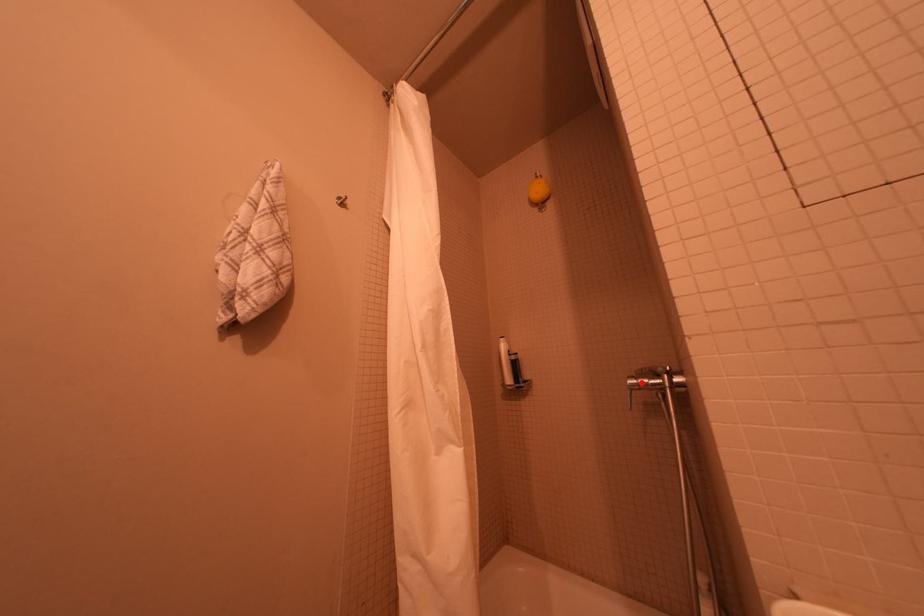
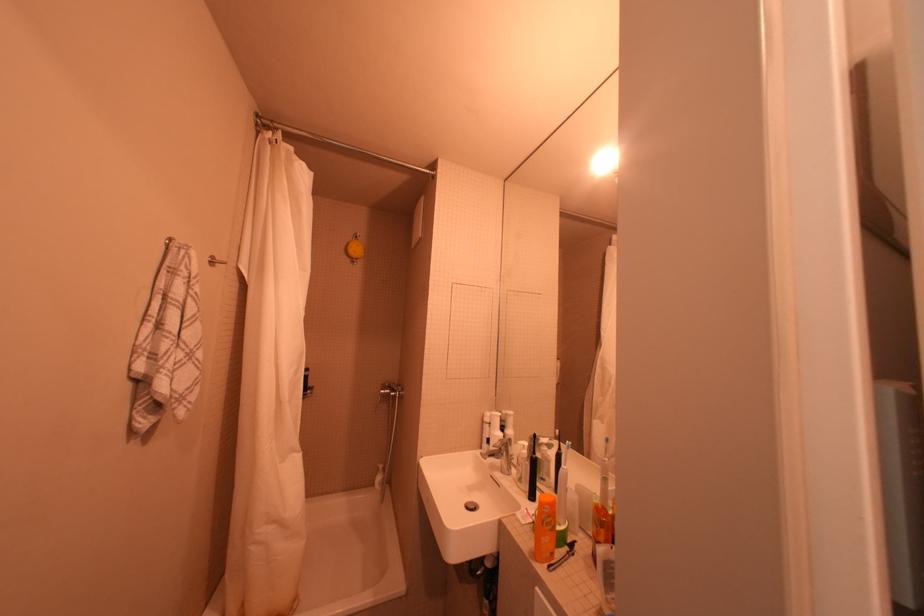
In the second image, find the point that corresponds to the highlighted location in the first image.

(391, 392)